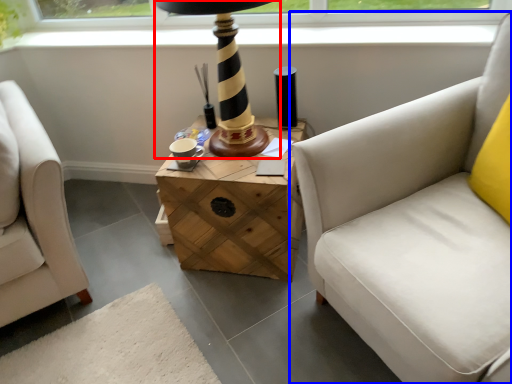
Question: Which of the following is the closest to the observer, table lamp (highlighted by a red box) or studio couch (highlighted by a blue box)?

Choices:
 (A) table lamp
 (B) studio couch

Answer: (B)